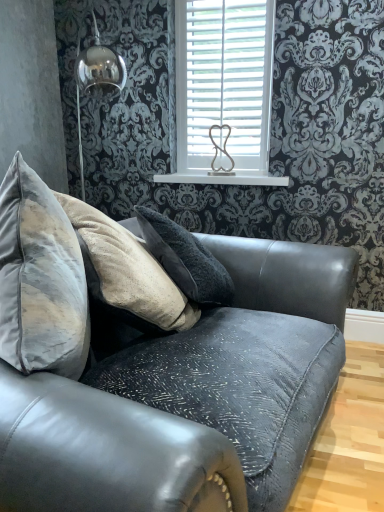
Question: Does white wooden blinds at upper center have a larger size compared to white glossy shelf at upper center?

Choices:
 (A) no
 (B) yes

Answer: (B)

Question: Would you consider white wooden blinds at upper center to be distant from white glossy shelf at upper center?

Choices:
 (A) yes
 (B) no

Answer: (B)

Question: Does white wooden blinds at upper center have a lesser height compared to white glossy shelf at upper center?

Choices:
 (A) no
 (B) yes

Answer: (A)

Question: Considering the relative sizes of white wooden blinds at upper center and white glossy shelf at upper center in the image provided, is white wooden blinds at upper center smaller than white glossy shelf at upper center?

Choices:
 (A) no
 (B) yes

Answer: (A)

Question: From the image's perspective, is white wooden blinds at upper center above white glossy shelf at upper center?

Choices:
 (A) no
 (B) yes

Answer: (B)

Question: Is velvet grey couch at center in front of or behind white wooden blinds at upper center in the image?

Choices:
 (A) front
 (B) behind

Answer: (A)

Question: Is point (264, 489) closer or farther from the camera than point (241, 101)?

Choices:
 (A) farther
 (B) closer

Answer: (B)

Question: Which is correct: velvet grey couch at center is inside white wooden blinds at upper center, or outside of it?

Choices:
 (A) outside
 (B) inside

Answer: (A)

Question: Is velvet grey couch at center wider or thinner than white wooden blinds at upper center?

Choices:
 (A) thin
 (B) wide

Answer: (B)

Question: Considering the positions of white glossy shelf at upper center and white wooden blinds at upper center in the image, is white glossy shelf at upper center taller or shorter than white wooden blinds at upper center?

Choices:
 (A) short
 (B) tall

Answer: (A)

Question: From the image's perspective, is white glossy shelf at upper center positioned above or below white wooden blinds at upper center?

Choices:
 (A) above
 (B) below

Answer: (B)

Question: Considering the positions of white glossy shelf at upper center and white wooden blinds at upper center in the image, is white glossy shelf at upper center bigger or smaller than white wooden blinds at upper center?

Choices:
 (A) big
 (B) small

Answer: (B)

Question: Is point (210, 175) positioned closer to the camera than point (248, 67)?

Choices:
 (A) closer
 (B) farther

Answer: (B)

Question: Considering the positions of white wooden blinds at upper center and velvet grey couch at center in the image, is white wooden blinds at upper center wider or thinner than velvet grey couch at center?

Choices:
 (A) thin
 (B) wide

Answer: (A)

Question: In terms of size, does white wooden blinds at upper center appear bigger or smaller than velvet grey couch at center?

Choices:
 (A) big
 (B) small

Answer: (B)